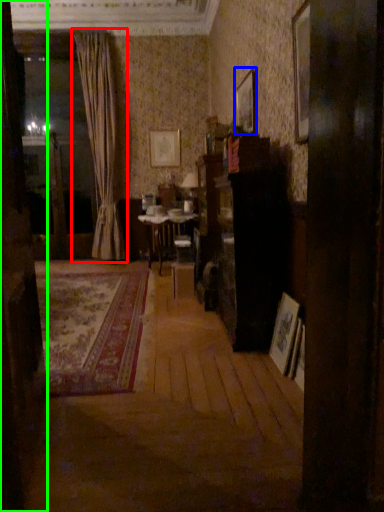
Question: Estimate the real-world distances between objects in this image. Which object is closer to curtain (highlighted by a red box), picture frame (highlighted by a blue box) or door (highlighted by a green box)?

Choices:
 (A) picture frame
 (B) door

Answer: (A)